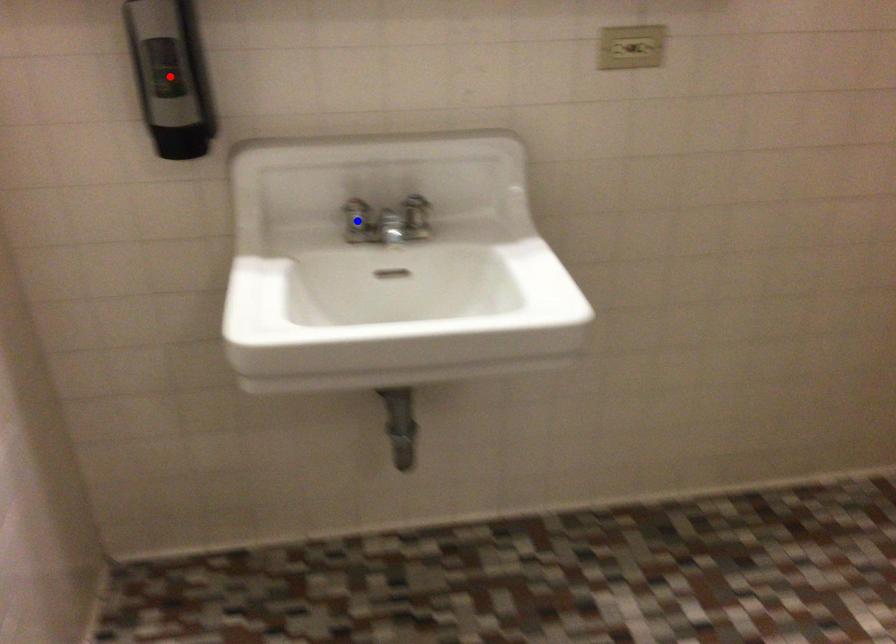
Question: Two points are marked on the image. Which point is closer to the camera?

Choices:
 (A) Blue point is closer.
 (B) Red point is closer.

Answer: (B)